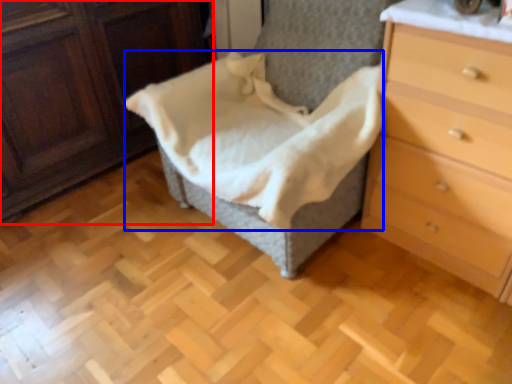
Question: Which point is closer to the camera, furniture (highlighted by a red box) or blanket (highlighted by a blue box)?

Choices:
 (A) furniture
 (B) blanket

Answer: (B)